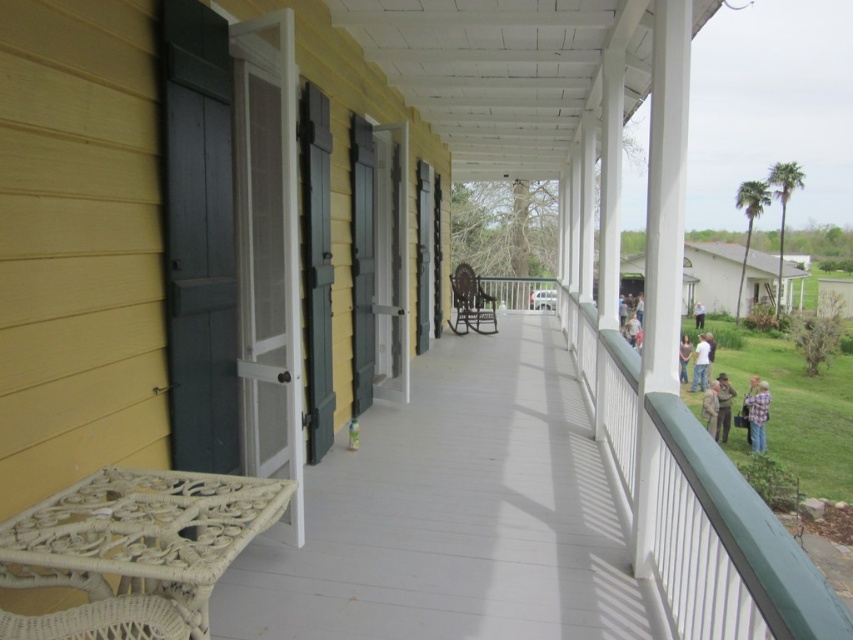
Can you confirm if white wicker table at lower left is wider than light brown leather jacket at lower right?

Correct, the width of white wicker table at lower left exceeds that of light brown leather jacket at lower right.

Is white wicker table at lower left above light brown leather jacket at lower right?

Yes.

Is point (213, 602) positioned after point (715, 387)?

That is False.

I want to click on white wicker table at lower left, so [x=138, y=554].

Between white wicker table at lower left and white wicker balustrade at lower left, which one is positioned higher?

white wicker table at lower left is higher up.

Does point (660, 588) come closer to viewer compared to point (28, 522)?

No, (660, 588) is further to viewer.

The width and height of the screenshot is (853, 640). Identify the location of white wicker table at lower left. (138, 554).

Looking at this image, which of these two, white wicker balustrade at lower left or white cotton shirt at center, stands taller?

white cotton shirt at center

Does point (91, 589) come closer to viewer compared to point (701, 342)?

That is True.

Identify the location of white wicker balustrade at lower left. (132, 550).